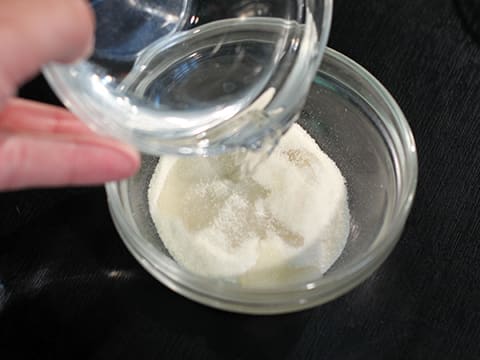
I want to click on black countertop, so click(425, 79).